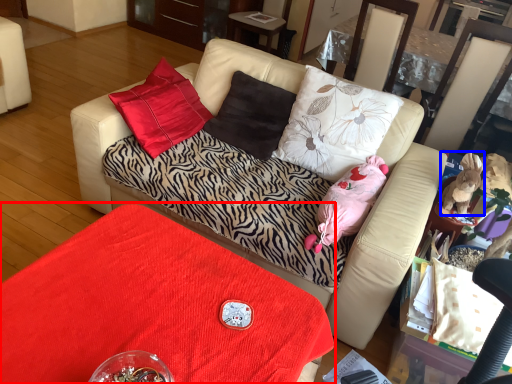
Question: Which of the following is the closest to the observer, table (highlighted by a red box) or animal (highlighted by a blue box)?

Choices:
 (A) table
 (B) animal

Answer: (A)